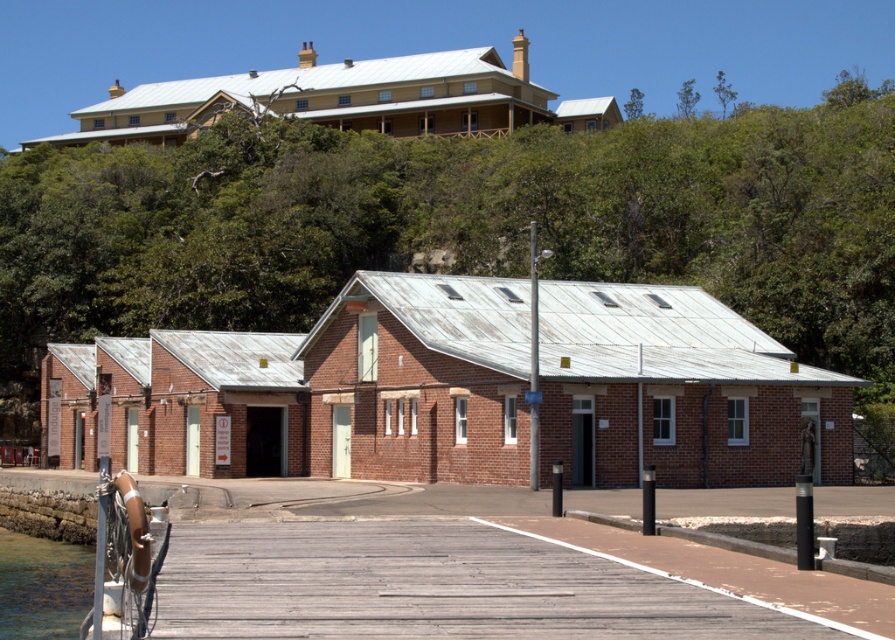
Question: Can you confirm if wooden planks at center is positioned to the right of clear water at dock lower left?

Choices:
 (A) no
 (B) yes

Answer: (B)

Question: Observing the image, what is the correct spatial positioning of wooden planks at center in reference to clear water at dock lower left?

Choices:
 (A) below
 (B) above

Answer: (B)

Question: Which object appears farthest from the camera in this image?

Choices:
 (A) clear water at dock lower left
 (B) wooden planks at center

Answer: (A)

Question: Is wooden planks at center above clear water at dock lower left?

Choices:
 (A) no
 (B) yes

Answer: (B)

Question: Among these points, which one is nearest to the camera?

Choices:
 (A) (676, 579)
 (B) (62, 582)

Answer: (A)